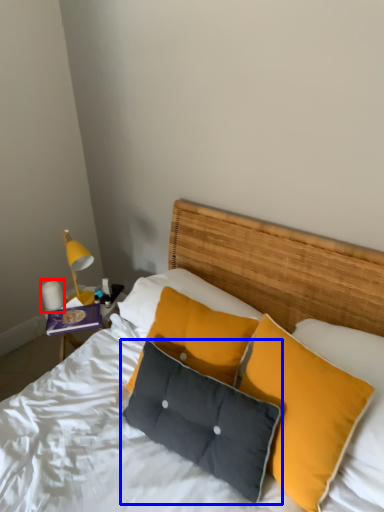
Question: Which point is closer to the camera, lamp (highlighted by a red box) or pillow (highlighted by a blue box)?

Choices:
 (A) lamp
 (B) pillow

Answer: (B)